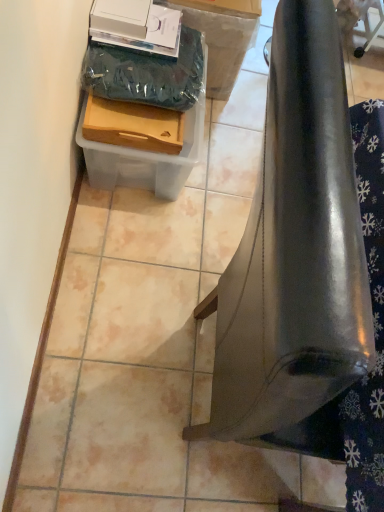
Image resolution: width=384 pixels, height=512 pixels. I want to click on free point in front of glossy metallic bell at lower right, so click(x=175, y=468).